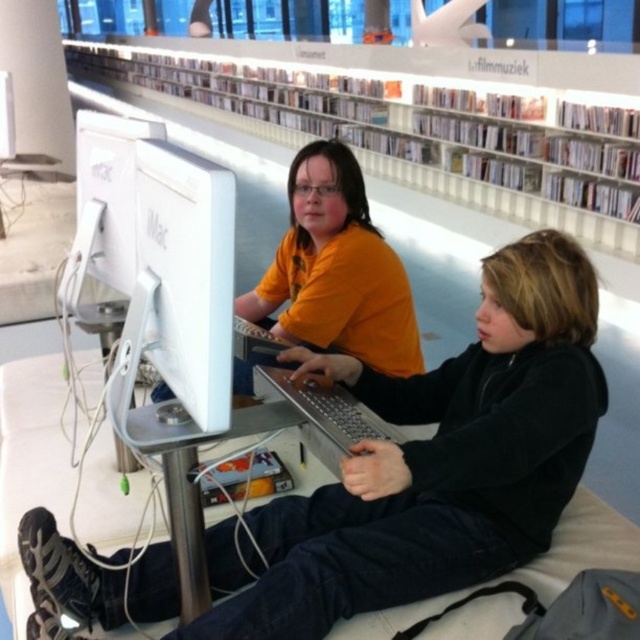
Question: Can you confirm if matte yellow shirt at center is smaller than white glossy imac at center?

Choices:
 (A) yes
 (B) no

Answer: (B)

Question: Estimate the real-world distances between objects in this image. Which object is closer to the matte yellow shirt at center?

Choices:
 (A) white plastic bookshelf at upper center
 (B) white glossy monitor at center
 (C) white glossy imac at center

Answer: (B)

Question: Considering the real-world distances, which object is closest to the white glossy monitor at center?

Choices:
 (A) matte yellow shirt at center
 (B) white glossy imac at center

Answer: (B)

Question: Is white plastic bookshelf at upper center further to the viewer compared to white glossy imac at center?

Choices:
 (A) yes
 (B) no

Answer: (A)

Question: Which object appears closest to the camera in this image?

Choices:
 (A) white glossy monitor at center
 (B) matte yellow shirt at center
 (C) white glossy imac at center
 (D) white plastic bookshelf at upper center

Answer: (C)

Question: Is white glossy imac at center bigger than white glossy monitor at center?

Choices:
 (A) no
 (B) yes

Answer: (A)